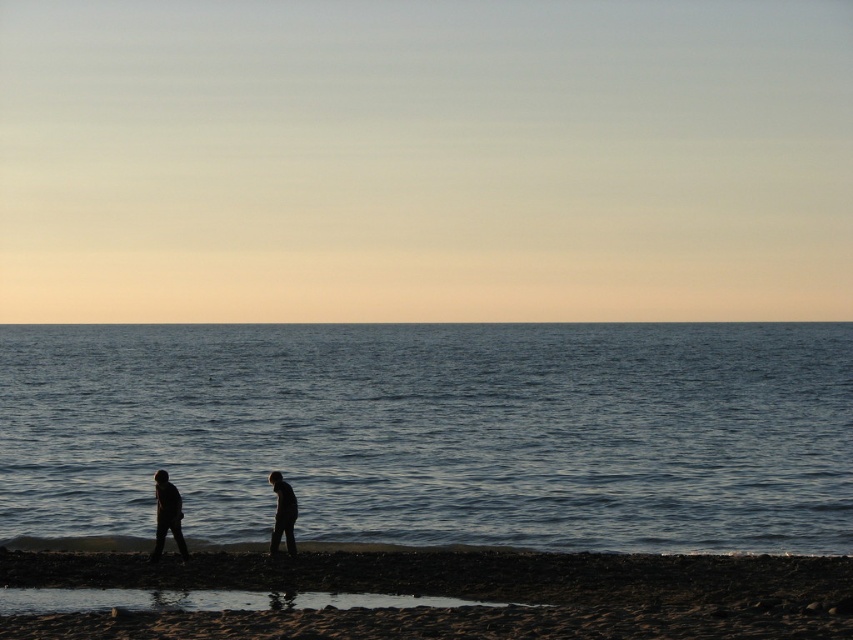
Can you confirm if dark sand at lower center is bigger than silhouette figure at lower center?

Indeed, dark sand at lower center has a larger size compared to silhouette figure at lower center.

Does dark sand at lower center come in front of silhouette figure at lower center?

Yes, it is.

Is point (392, 620) more distant than point (277, 481)?

No, (392, 620) is closer to viewer.

Where is `dark sand at lower center`? The width and height of the screenshot is (853, 640). dark sand at lower center is located at coordinates 463,595.

Based on the photo, which is above, dark sand at lower center or silhouette figures at lower center?

silhouette figures at lower center is above.

Does dark sand at lower center appear on the left side of silhouette figures at lower center?

Incorrect, dark sand at lower center is not on the left side of silhouette figures at lower center.

Find the location of a particular element. dark sand at lower center is located at coordinates (463, 595).

Is blue water at center behind silhouette figure at lower left?

Yes.

Does blue water at center have a lesser height compared to silhouette figure at lower left?

No.

Does point (477, 474) lie behind point (169, 493)?

Yes, point (477, 474) is farther from viewer.

This screenshot has width=853, height=640. What are the coordinates of `blue water at center` in the screenshot? It's located at (434, 433).